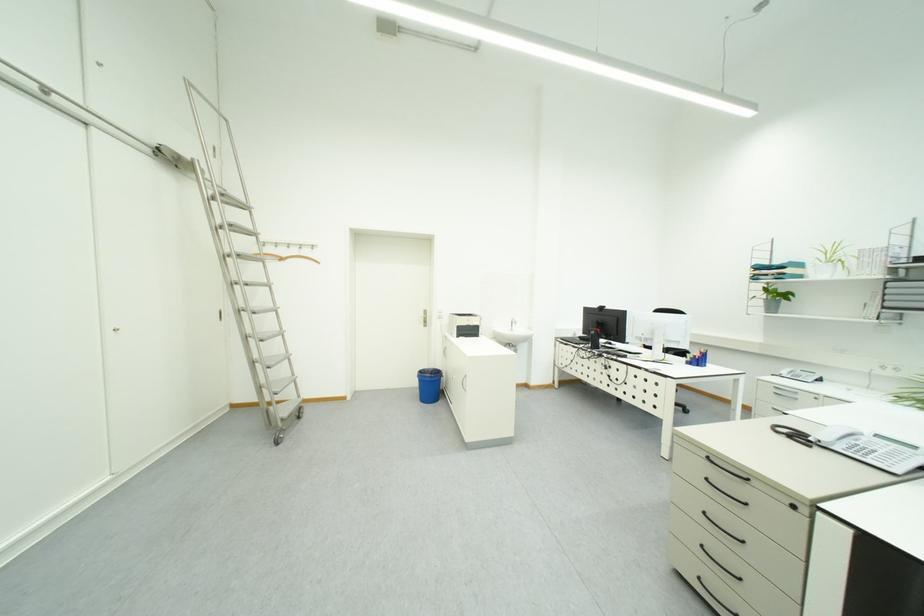
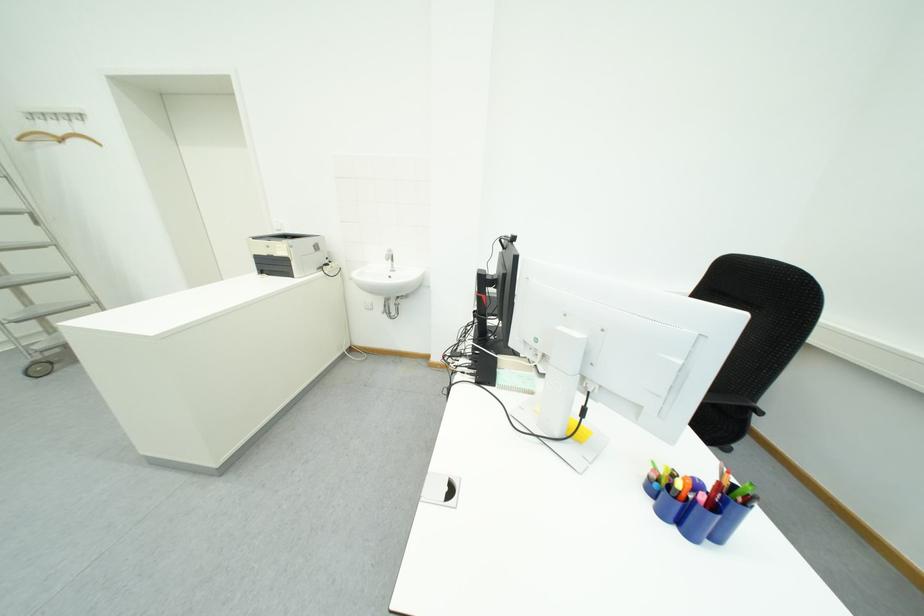
Question: I am providing you with two images of the same scene from different viewpoints. Which of the following objects are not visible in image2?

Choices:
 (A) yellow sticky notes
 (B) colorful pen
 (C) faucet handle
 (D) none of these

Answer: (D)